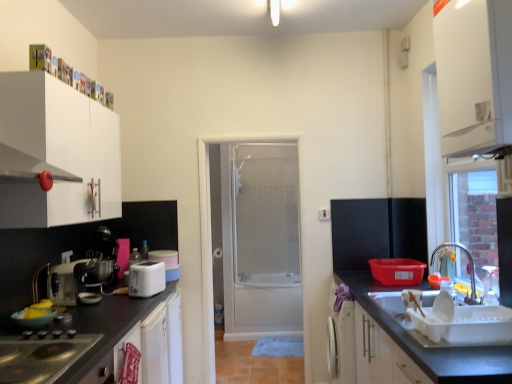
Question: Based on their sizes in the image, would you say white matte cabinet at lower left, which appears as the second cabinetry when viewed from the right, is bigger or smaller than white matte cabinet at left, which appears as the third cabinetry when viewed from the right?

Choices:
 (A) small
 (B) big

Answer: (A)

Question: Considering the positions of point (147, 360) and point (36, 137), is point (147, 360) closer or farther from the camera than point (36, 137)?

Choices:
 (A) closer
 (B) farther

Answer: (B)

Question: Which object is positioned closest to the metallic silver coffee machine at left?

Choices:
 (A) metallic silver mixer at left, which is counted as the 3th appliance, starting from the back
 (B) silver metallic faucet at right
 (C) black glass gas stove at lower left
 (D) smooth black countertop at lower right
 (E) white matte cabinet at lower left, the 2th cabinetry positioned from the left

Answer: (A)

Question: Considering the real-world distances, which object is closest to the silver metallic faucet at right?

Choices:
 (A) metallic silver coffee machine at left
 (B) black glass gas stove at lower left
 (C) metallic silver mixer at left, the 1th appliance from the front
 (D) white matte cabinet at lower left, the 2th cabinetry positioned from the left
 (E) white matte cabinet at upper right, the first cabinetry viewed from the right

Answer: (E)